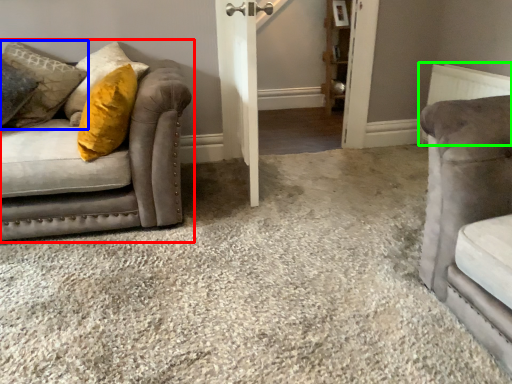
Question: Which is farther away from studio couch (highlighted by a red box)? pillow (highlighted by a blue box) or radiator (highlighted by a green box)?

Choices:
 (A) pillow
 (B) radiator

Answer: (B)